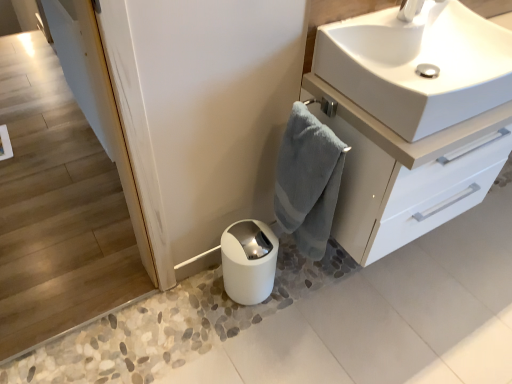
Question: Considering the relative sizes of white glossy sink at upper right and white glossy toilet paper at lower center in the image provided, is white glossy sink at upper right bigger than white glossy toilet paper at lower center?

Choices:
 (A) yes
 (B) no

Answer: (A)

Question: Is the depth of white glossy sink at upper right less than that of white glossy toilet paper at lower center?

Choices:
 (A) no
 (B) yes

Answer: (B)

Question: Does white glossy sink at upper right have a lesser height compared to white glossy toilet paper at lower center?

Choices:
 (A) no
 (B) yes

Answer: (B)

Question: Is white glossy sink at upper right aimed at white glossy toilet paper at lower center?

Choices:
 (A) yes
 (B) no

Answer: (B)

Question: Does white glossy sink at upper right have a smaller size compared to white glossy toilet paper at lower center?

Choices:
 (A) no
 (B) yes

Answer: (A)

Question: Which is correct: white glossy cabinet at upper right is inside gray cotton towel at center-right, or outside of it?

Choices:
 (A) inside
 (B) outside

Answer: (B)

Question: Does point (x=326, y=104) appear closer or farther from the camera than point (x=307, y=157)?

Choices:
 (A) closer
 (B) farther

Answer: (B)

Question: Based on their sizes in the image, would you say white glossy cabinet at upper right is bigger or smaller than gray cotton towel at center-right?

Choices:
 (A) big
 (B) small

Answer: (A)

Question: From a real-world perspective, is white glossy cabinet at upper right above or below gray cotton towel at center-right?

Choices:
 (A) above
 (B) below

Answer: (A)

Question: Looking at their shapes, would you say white glossy cabinet at upper right is wider or thinner than white glossy sink at upper right?

Choices:
 (A) wide
 (B) thin

Answer: (A)

Question: Is white glossy cabinet at upper right to the left or to the right of white glossy sink at upper right in the image?

Choices:
 (A) right
 (B) left

Answer: (A)

Question: From a real-world perspective, relative to white glossy sink at upper right, is white glossy cabinet at upper right vertically above or below?

Choices:
 (A) above
 (B) below

Answer: (B)

Question: Does point (351, 132) appear closer or farther from the camera than point (388, 11)?

Choices:
 (A) farther
 (B) closer

Answer: (B)

Question: Considering their positions, is white glossy toilet paper at lower center located in front of or behind white glossy sink at upper right?

Choices:
 (A) behind
 (B) front

Answer: (A)

Question: Visually, is white glossy toilet paper at lower center positioned to the left or to the right of white glossy sink at upper right?

Choices:
 (A) right
 (B) left

Answer: (B)